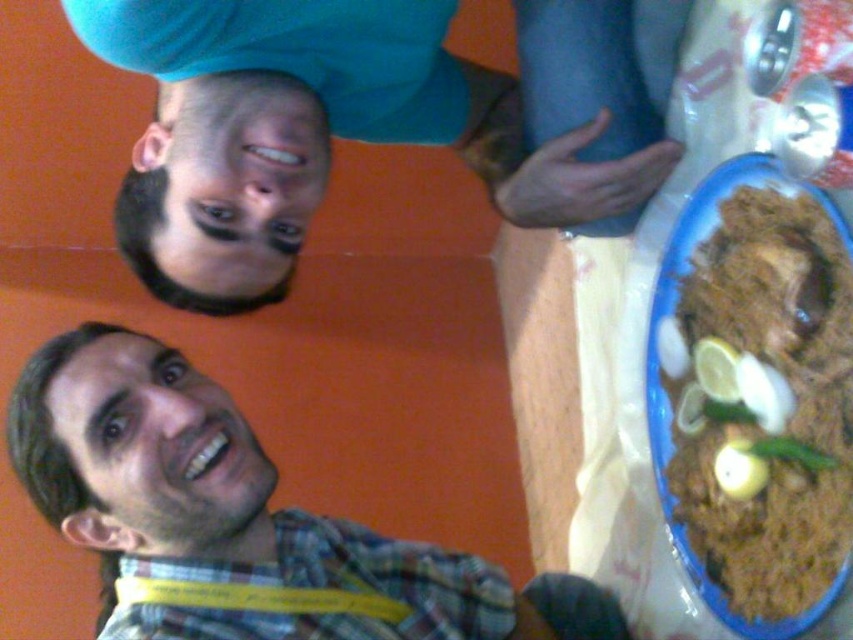
Question: Which object appears closest to the camera in this image?

Choices:
 (A) brown matte rice at right
 (B) plaid shirt at lower left
 (C) blue fabric shirt at upper center

Answer: (A)

Question: Based on their relative distances, which object is farther from the blue fabric shirt at upper center?

Choices:
 (A) brown matte rice at right
 (B) plaid shirt at lower left

Answer: (B)

Question: Does blue fabric shirt at upper center appear on the left side of brown matte rice at right?

Choices:
 (A) no
 (B) yes

Answer: (B)

Question: Is blue fabric shirt at upper center positioned in front of plaid shirt at lower left?

Choices:
 (A) no
 (B) yes

Answer: (B)

Question: Which point appears closest to the camera in this image?

Choices:
 (A) (316, 129)
 (B) (775, 189)
 (C) (248, 484)

Answer: (C)

Question: In this image, where is plaid shirt at lower left located relative to brown matte rice at right?

Choices:
 (A) right
 (B) left

Answer: (B)